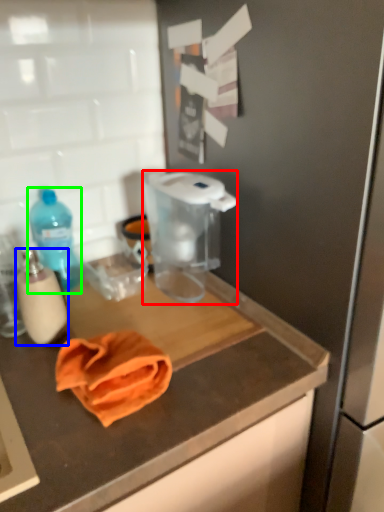
Question: Estimate the real-world distances between objects in this image. Which object is closer to appliance (highlighted by a red box), bottle (highlighted by a blue box) or bottle (highlighted by a green box)?

Choices:
 (A) bottle
 (B) bottle

Answer: (B)